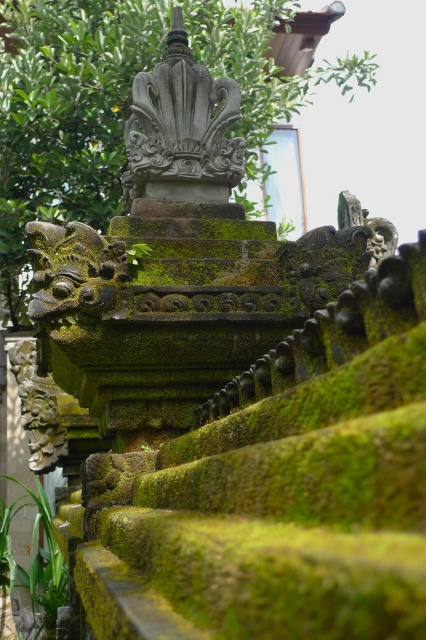
From the picture: Can you confirm if green mossy stone at center is taller than gray stone sculpture at center?

Yes, green mossy stone at center is taller than gray stone sculpture at center.

Is green mossy stone at center below gray stone sculpture at center?

No.

Looking at this image, who is more distant from viewer, [121,33] or [135,83]?

Point [121,33]

In order to click on green mossy stone at center in this screenshot , I will do `click(120, 104)`.